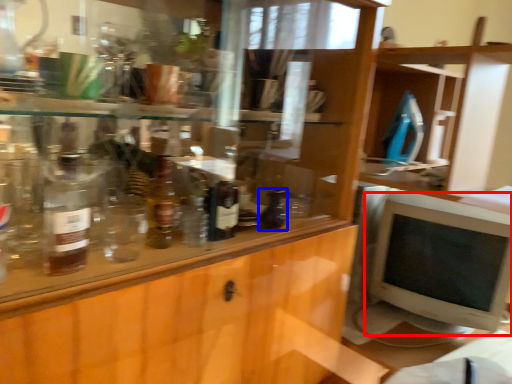
Question: Which point is closer to the camera, computer monitor (highlighted by a red box) or bottle (highlighted by a blue box)?

Choices:
 (A) computer monitor
 (B) bottle

Answer: (B)